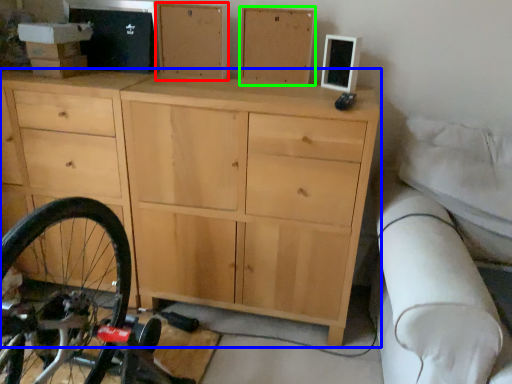
Question: Which is nearer to the chest of drawer (highlighted by a red box)? chest of drawers (highlighted by a blue box) or chest of drawer (highlighted by a green box).

Choices:
 (A) chest of drawers
 (B) chest of drawer

Answer: (B)